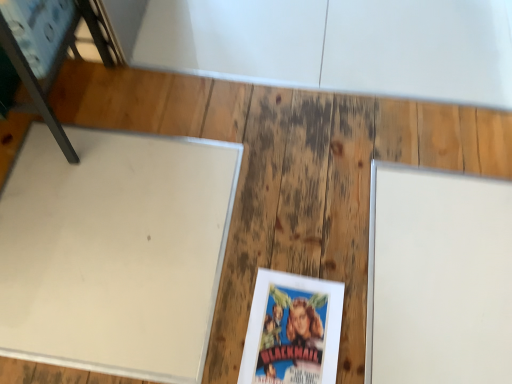
Question: Considering the relative positions of white matte board at left and white matte board at right in the image provided, is white matte board at left to the right of white matte board at right from the viewer's perspective?

Choices:
 (A) no
 (B) yes

Answer: (A)

Question: From the image's perspective, is white matte board at left above white matte board at right?

Choices:
 (A) yes
 (B) no

Answer: (A)

Question: Is white matte board at right surrounded by white matte board at left?

Choices:
 (A) no
 (B) yes

Answer: (A)

Question: Is white matte board at left in front of white matte board at right?

Choices:
 (A) yes
 (B) no

Answer: (B)

Question: Considering the relative sizes of white matte board at left and white matte board at right in the image provided, is white matte board at left bigger than white matte board at right?

Choices:
 (A) no
 (B) yes

Answer: (B)

Question: Considering the relative sizes of white matte board at left and white matte board at right in the image provided, is white matte board at left thinner than white matte board at right?

Choices:
 (A) no
 (B) yes

Answer: (A)

Question: Does white matte board at right come behind metallic blue chair at upper left?

Choices:
 (A) no
 (B) yes

Answer: (B)

Question: From a real-world perspective, is white matte board at right physically above metallic blue chair at upper left?

Choices:
 (A) yes
 (B) no

Answer: (B)

Question: Considering the relative sizes of white matte board at right and metallic blue chair at upper left in the image provided, is white matte board at right smaller than metallic blue chair at upper left?

Choices:
 (A) no
 (B) yes

Answer: (B)

Question: Does white matte board at right have a lesser height compared to metallic blue chair at upper left?

Choices:
 (A) no
 (B) yes

Answer: (B)

Question: Is white matte board at right with metallic blue chair at upper left?

Choices:
 (A) yes
 (B) no

Answer: (B)

Question: Considering the relative sizes of white matte board at right and metallic blue chair at upper left in the image provided, is white matte board at right taller than metallic blue chair at upper left?

Choices:
 (A) no
 (B) yes

Answer: (A)

Question: Is white matte board at left with metallic blue chair at upper left?

Choices:
 (A) yes
 (B) no

Answer: (B)